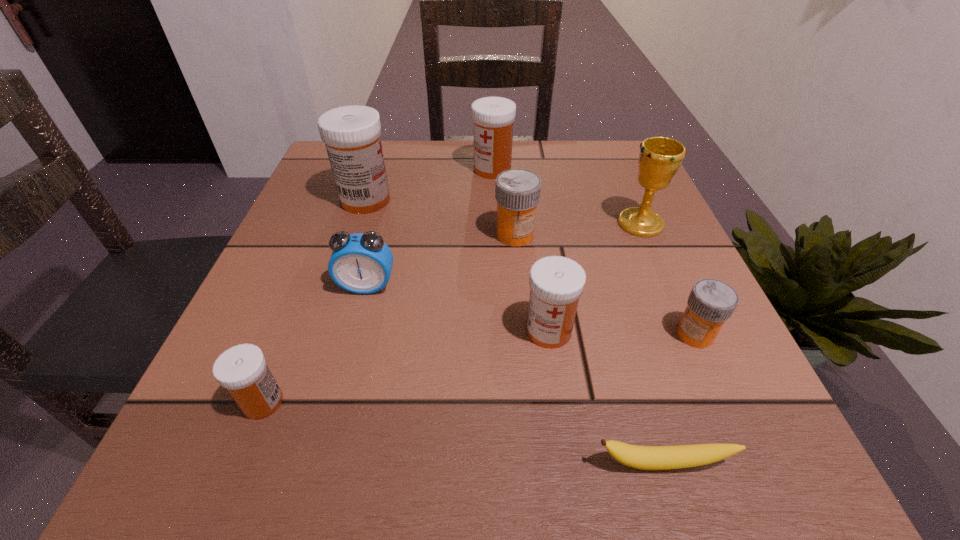
Identify the location of medicine that is the nearest to the smallest white medicine. This screenshot has height=540, width=960. (556, 282).

Identify which white medicine is the fourth nearest to the gold chalice. Please provide its 2D coordinates. Your answer should be formatted as a tuple, i.e. [(x, y)], where the tuple contains the x and y coordinates of a point satisfying the conditions above.

[(242, 370)]

Find the location of a particular element. Image resolution: width=960 pixels, height=540 pixels. white medicine object that ranks as the closest to the smaller orange medicine is located at coordinates (556, 282).

You are a GUI agent. You are given a task and a screenshot of the screen. Output one action in this format:
    pyautogui.click(x=<x>, y=<y>)
    Task: Click on the vacant region that satisfies the following two spatial constraints: 1. on the back side of the tallest medicine; 2. on the right side of the nearest medicine
    The height and width of the screenshot is (540, 960).
    Given the screenshot: What is the action you would take?
    pyautogui.click(x=343, y=200)

You are a GUI agent. You are given a task and a screenshot of the screen. Output one action in this format:
    pyautogui.click(x=<x>, y=<y>)
    Task: Click on the free region that satisfies the following two spatial constraints: 1. on the front side of the gold chalice; 2. on the right side of the tallest medicine
    The image size is (960, 540).
    Given the screenshot: What is the action you would take?
    pyautogui.click(x=358, y=224)